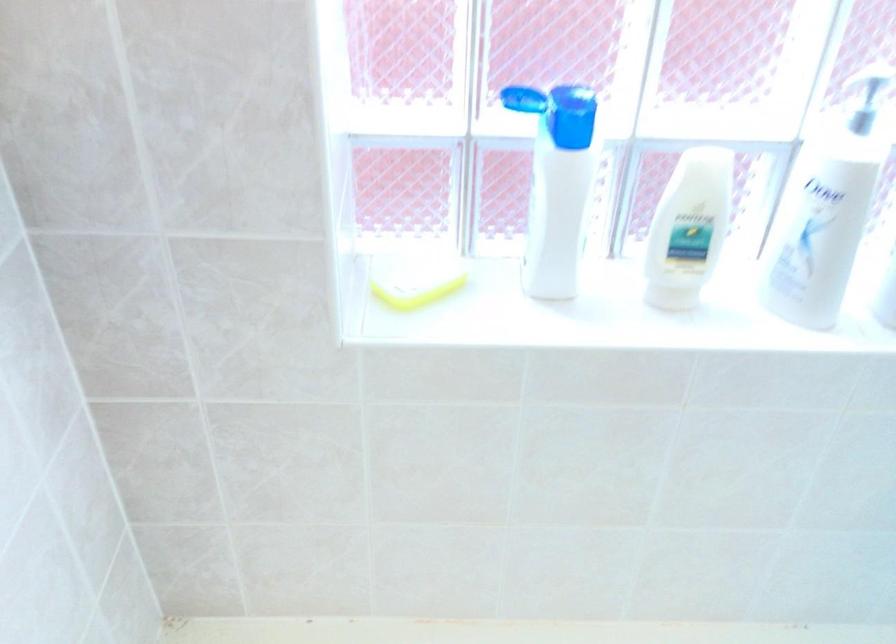
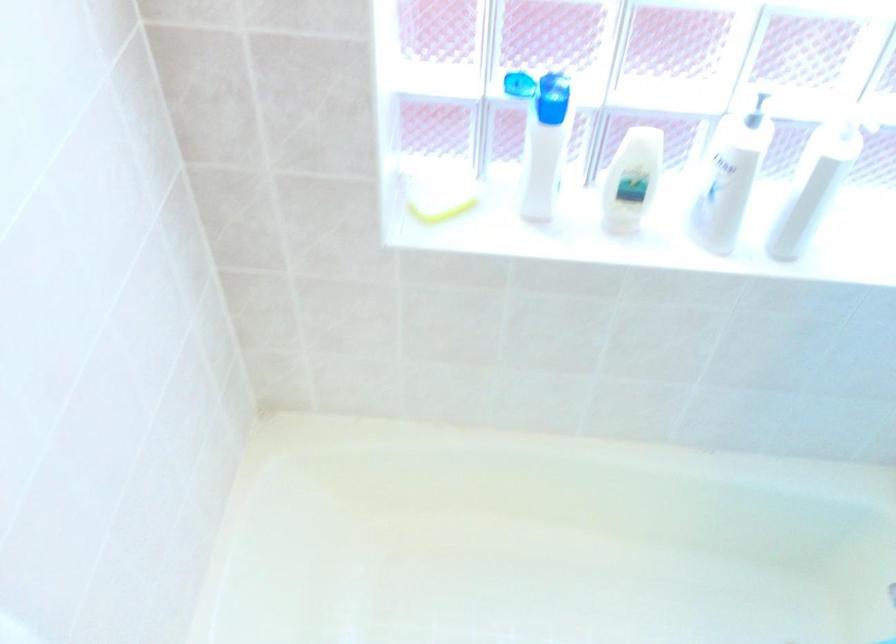
Locate, in the second image, the point that corresponds to point 547,104 in the first image.

(537, 88)